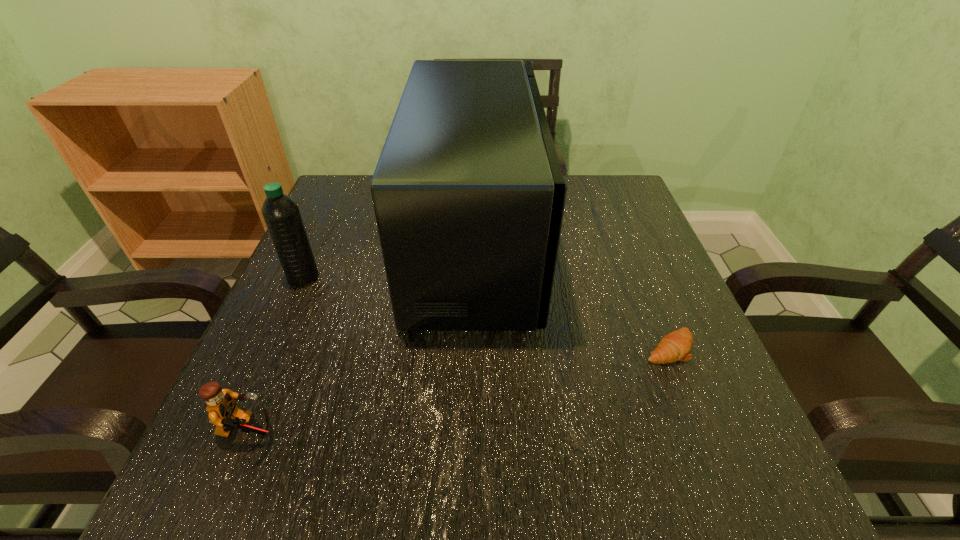
Find the location of a particular element. The width and height of the screenshot is (960, 540). vacant space at the far left corner of the desktop is located at coordinates (333, 184).

Where is `vacant area at the far right corner`? This screenshot has height=540, width=960. vacant area at the far right corner is located at coordinates (576, 198).

What are the coordinates of `free point between the second tallest object and the second shortest object` in the screenshot? It's located at (276, 355).

At what (x,y) coordinates should I click in order to perform the action: click on vacant area that lies between the tallest object and the rightmost object. Please return your answer as a coordinate pair (x, y). The height and width of the screenshot is (540, 960). Looking at the image, I should click on (572, 294).

This screenshot has height=540, width=960. What are the coordinates of `free space between the rightmost object and the Lego` in the screenshot? It's located at (459, 390).

This screenshot has height=540, width=960. Find the location of `free point between the Lego and the crescent roll`. free point between the Lego and the crescent roll is located at coordinates (459, 390).

Identify the location of empty location between the second shortest object and the shortest object. This screenshot has width=960, height=540. (459, 390).

Identify the location of free spot between the rightmost object and the third tallest object. (459, 390).

Where is `vacant space that is in between the third tallest object and the shortest object`? Image resolution: width=960 pixels, height=540 pixels. vacant space that is in between the third tallest object and the shortest object is located at coordinates (459, 390).

The image size is (960, 540). In order to click on object that stands as the third closest to the shortest object in this screenshot , I will do `click(281, 214)`.